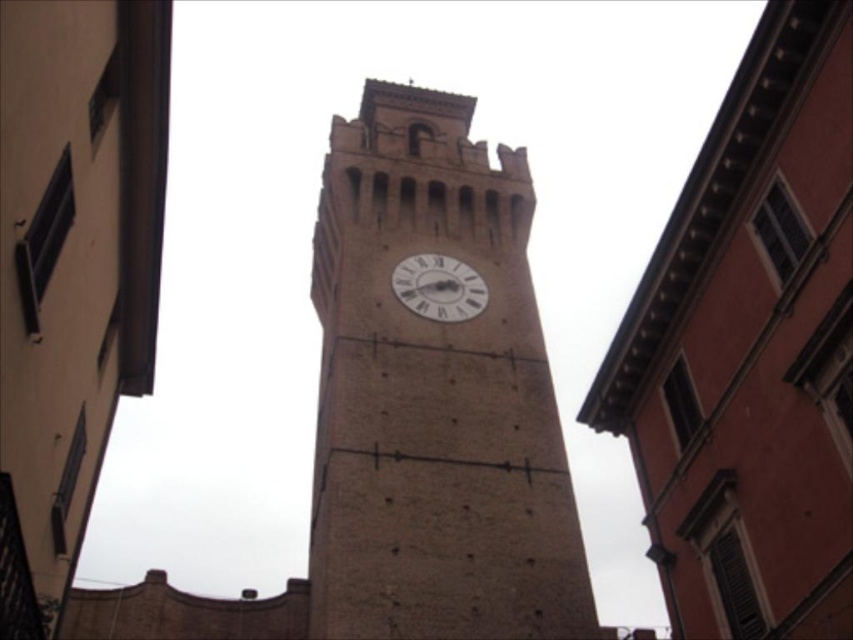
You are an architect reviewing a blueprint and notice the brown stone clock tower at center and the white matte clock at center. Which structure is bigger in terms of physical dimensions?

The brown stone clock tower at center is larger in size than the white matte clock at center, so the brown stone clock tower at center is bigger.

You are standing in front of the clock tower and want to take a photo. You notice two points marked on the tower. The first point is at coordinates point (387, 136) and the second at point (477, 301). Which point is closer to your camera?

Point (387, 136) is further to the camera than point (477, 301), so the second point is closer to your camera.

You are an architect evaluating the proportions of the buildings in the image. Given the brown stone clock tower at center and the white matte clock at center, which one is taller?

The brown stone clock tower at center is taller than the white matte clock at center.